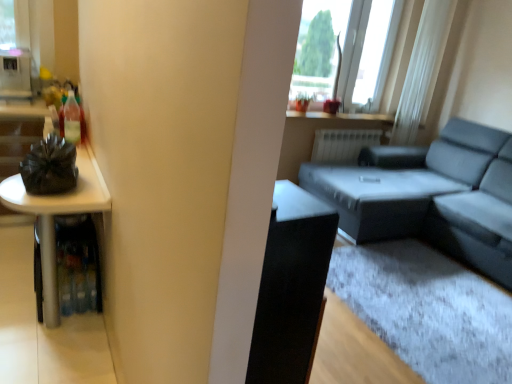
Question: From a real-world perspective, is matte gray couch at right on white glossy refrigerator at upper left?

Choices:
 (A) no
 (B) yes

Answer: (A)

Question: Is white glossy refrigerator at upper left a part of matte gray couch at right?

Choices:
 (A) no
 (B) yes

Answer: (A)

Question: Is matte gray couch at right wider than white glossy refrigerator at upper left?

Choices:
 (A) no
 (B) yes

Answer: (B)

Question: Is matte gray couch at right positioned beyond the bounds of white glossy refrigerator at upper left?

Choices:
 (A) no
 (B) yes

Answer: (B)

Question: Considering the relative sizes of matte gray couch at right and white glossy refrigerator at upper left in the image provided, is matte gray couch at right shorter than white glossy refrigerator at upper left?

Choices:
 (A) no
 (B) yes

Answer: (A)

Question: In terms of size, does matte gray couch at right appear bigger or smaller than transparent glass window at upper right?

Choices:
 (A) small
 (B) big

Answer: (B)

Question: Considering their positions, is matte gray couch at right located in front of or behind transparent glass window at upper right?

Choices:
 (A) behind
 (B) front

Answer: (B)

Question: Looking at their shapes, would you say matte gray couch at right is wider or thinner than transparent glass window at upper right?

Choices:
 (A) wide
 (B) thin

Answer: (A)

Question: From a real-world perspective, is matte gray couch at right above or below transparent glass window at upper right?

Choices:
 (A) above
 (B) below

Answer: (B)

Question: Relative to matte gray couch at right, is transparent glass window at upper right in front or behind?

Choices:
 (A) behind
 (B) front

Answer: (A)

Question: In terms of width, does transparent glass window at upper right look wider or thinner when compared to matte gray couch at right?

Choices:
 (A) wide
 (B) thin

Answer: (B)

Question: Is transparent glass window at upper right situated inside matte gray couch at right or outside?

Choices:
 (A) inside
 (B) outside

Answer: (B)

Question: From a real-world perspective, relative to matte gray couch at right, is transparent glass window at upper right vertically above or below?

Choices:
 (A) above
 (B) below

Answer: (A)

Question: Is point (14, 79) closer or farther from the camera than point (345, 230)?

Choices:
 (A) farther
 (B) closer

Answer: (B)

Question: Considering the positions of white glossy refrigerator at upper left and matte gray couch at right in the image, is white glossy refrigerator at upper left taller or shorter than matte gray couch at right?

Choices:
 (A) tall
 (B) short

Answer: (B)